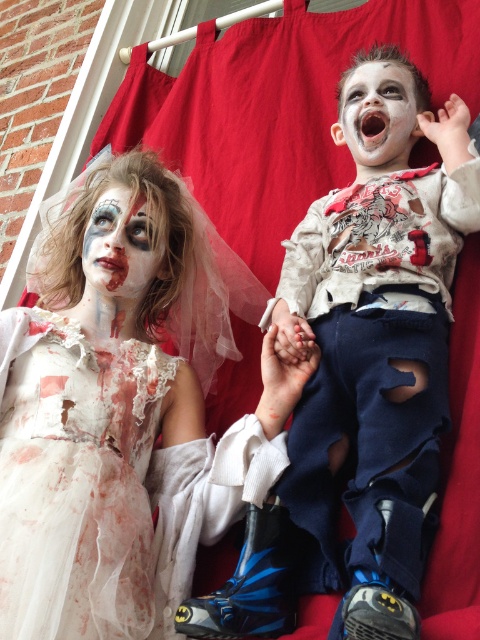
Question: Is white lace dress at left positioned in front of matte white face at center?

Choices:
 (A) no
 (B) yes

Answer: (B)

Question: Is white matte face at upper right closer to the viewer compared to matte white face at center?

Choices:
 (A) no
 (B) yes

Answer: (A)

Question: Which object appears farthest from the camera in this image?

Choices:
 (A) matte white face at center
 (B) distressed white shirt at upper right

Answer: (A)

Question: Which is nearer to the distressed white shirt at upper right?

Choices:
 (A) white matte face at upper right
 (B) matte white face at center
 (C) white lace dress at left

Answer: (A)

Question: Estimate the real-world distances between objects in this image. Which object is farther from the white lace dress at left?

Choices:
 (A) distressed white shirt at upper right
 (B) matte white face at center

Answer: (A)

Question: Does white lace dress at left appear on the right side of matte white face at center?

Choices:
 (A) yes
 (B) no

Answer: (B)